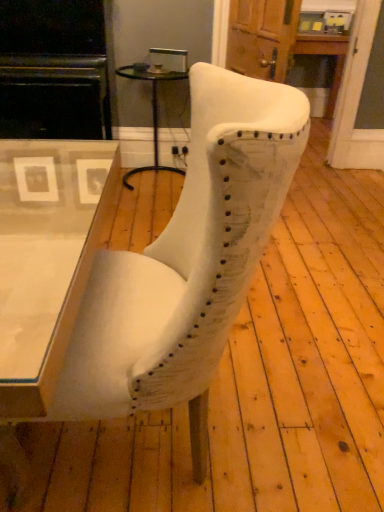
Question: Is white fabric chair at center further to camera compared to matte black entertainment center at left?

Choices:
 (A) yes
 (B) no

Answer: (B)

Question: Considering the relative positions of white fabric chair at center and matte black entertainment center at left in the image provided, is white fabric chair at center to the right of matte black entertainment center at left from the viewer's perspective?

Choices:
 (A) no
 (B) yes

Answer: (B)

Question: From a real-world perspective, is white fabric chair at center physically below matte black entertainment center at left?

Choices:
 (A) no
 (B) yes

Answer: (B)

Question: From the image's perspective, is white fabric chair at center on top of matte black entertainment center at left?

Choices:
 (A) yes
 (B) no

Answer: (B)

Question: Considering the relative sizes of white fabric chair at center and matte black entertainment center at left in the image provided, is white fabric chair at center taller than matte black entertainment center at left?

Choices:
 (A) yes
 (B) no

Answer: (B)

Question: From the image's perspective, is black glass side table at center located above or below matte black entertainment center at left?

Choices:
 (A) above
 (B) below

Answer: (B)

Question: Is black glass side table at center in front of or behind matte black entertainment center at left in the image?

Choices:
 (A) behind
 (B) front

Answer: (A)

Question: From a real-world perspective, is black glass side table at center positioned above or below matte black entertainment center at left?

Choices:
 (A) below
 (B) above

Answer: (A)

Question: Considering the positions of black glass side table at center and matte black entertainment center at left in the image, is black glass side table at center taller or shorter than matte black entertainment center at left?

Choices:
 (A) short
 (B) tall

Answer: (A)

Question: From their relative heights in the image, would you say matte black entertainment center at left is taller or shorter than white fabric chair at center?

Choices:
 (A) tall
 (B) short

Answer: (A)

Question: Would you say matte black entertainment center at left is to the left or to the right of white fabric chair at center in the picture?

Choices:
 (A) right
 (B) left

Answer: (B)

Question: Would you say matte black entertainment center at left is inside or outside white fabric chair at center?

Choices:
 (A) inside
 (B) outside

Answer: (B)

Question: Does point (39, 130) appear closer or farther from the camera than point (271, 108)?

Choices:
 (A) closer
 (B) farther

Answer: (B)

Question: In the image, is black glass side table at center on the left side or the right side of white fabric chair at center?

Choices:
 (A) left
 (B) right

Answer: (A)

Question: Based on their sizes in the image, would you say black glass side table at center is bigger or smaller than white fabric chair at center?

Choices:
 (A) big
 (B) small

Answer: (B)